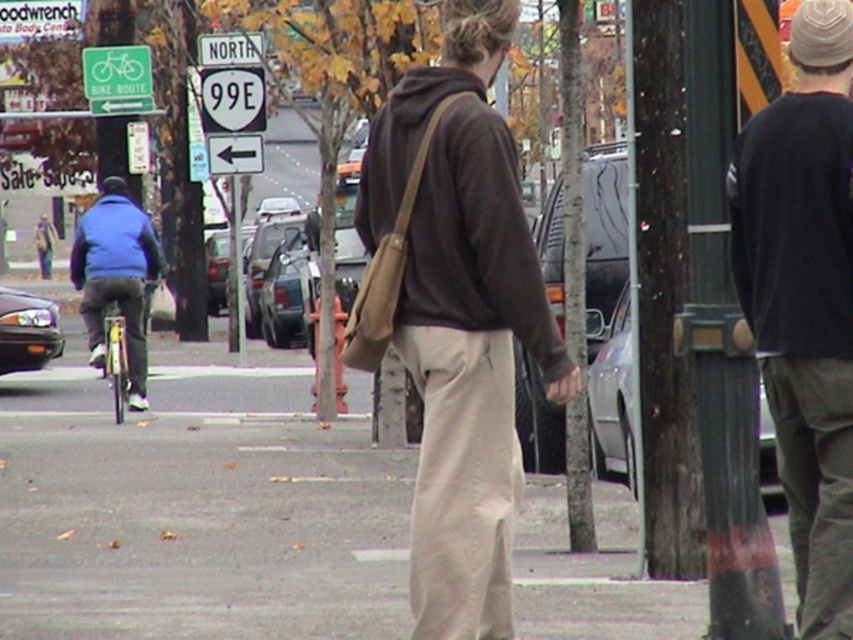
Question: Is khaki pants at center wider than black cotton sweater at upper right?

Choices:
 (A) no
 (B) yes

Answer: (B)

Question: Is brown leather bag at center below black cotton sweater at upper right?

Choices:
 (A) yes
 (B) no

Answer: (A)

Question: Does black cotton sweater at upper right have a larger size compared to blue fleece jacket at left?

Choices:
 (A) no
 (B) yes

Answer: (A)

Question: Which object is the farthest from the brown leather bag at center?

Choices:
 (A) blue fleece jacket at left
 (B) black cotton sweater at upper right
 (C) khaki pants at center

Answer: (A)

Question: Which point is farther to the camera?

Choices:
 (A) khaki pants at center
 (B) blue fleece jacket at left

Answer: (B)

Question: Which point appears closest to the camera in this image?

Choices:
 (A) (792, 273)
 (B) (421, 448)
 (C) (99, 307)
 (D) (431, 557)

Answer: (A)